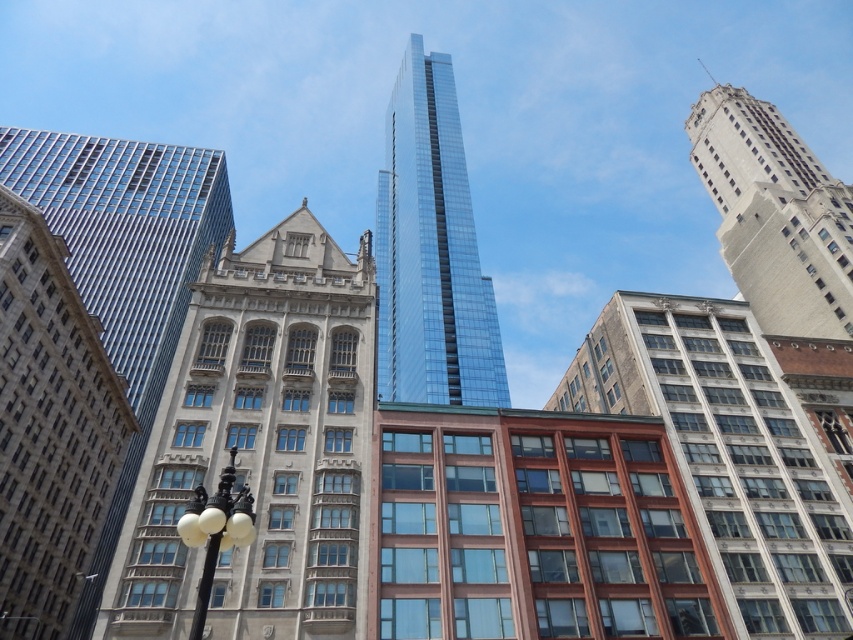
Question: In this image, where is stone textured building at center located relative to white stone tower at upper right?

Choices:
 (A) right
 (B) left

Answer: (B)

Question: Which point is farther to the camera?

Choices:
 (A) (379, 200)
 (B) (741, 620)
 (C) (209, 524)
 (D) (782, 301)

Answer: (A)

Question: Does shiny glass skyscraper at center appear on the left side of white stone tower at upper right?

Choices:
 (A) no
 (B) yes

Answer: (B)

Question: Which point appears closest to the camera in this image?

Choices:
 (A) (102, 534)
 (B) (398, 211)
 (C) (750, 218)
 (D) (244, 513)

Answer: (D)

Question: Does stone textured building at center have a lesser width compared to shiny glass skyscraper at center?

Choices:
 (A) yes
 (B) no

Answer: (A)

Question: Which point is closer to the camera?

Choices:
 (A) white stone tower at upper right
 (B) shiny glass skyscraper at center

Answer: (B)